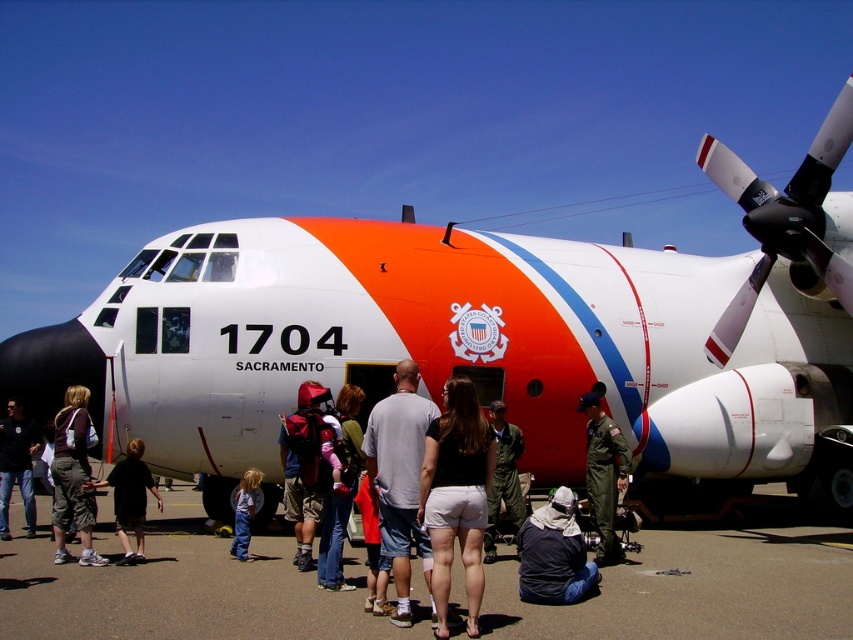
Can you confirm if gray cotton shirt at center is positioned to the left of light blue denim jeans at lower center?

Incorrect, gray cotton shirt at center is not on the left side of light blue denim jeans at lower center.

Does gray cotton shirt at center have a lesser width compared to light blue denim jeans at lower center?

No, gray cotton shirt at center is not thinner than light blue denim jeans at lower center.

Does point (413, 449) lie behind point (242, 493)?

No, (413, 449) is in front of (242, 493).

Where is `gray cotton shirt at center`? gray cotton shirt at center is located at coordinates (399, 480).

Is the position of smooth asphalt tarmac at center less distant than that of white cotton shorts at center?

No, it is not.

The image size is (853, 640). Find the location of `smooth asphalt tarmac at center`. smooth asphalt tarmac at center is located at coordinates (181, 589).

Locate an element on the screen. This screenshot has height=640, width=853. smooth asphalt tarmac at center is located at coordinates (181, 589).

Does black rubber propeller at right appear under black fabric shirt at lower left?

Incorrect, black rubber propeller at right is not positioned below black fabric shirt at lower left.

Can you confirm if black rubber propeller at right is shorter than black fabric shirt at lower left?

No, black rubber propeller at right is not shorter than black fabric shirt at lower left.

What do you see at coordinates (782, 221) in the screenshot? The height and width of the screenshot is (640, 853). I see `black rubber propeller at right` at bounding box center [782, 221].

Where is `black rubber propeller at right`? The width and height of the screenshot is (853, 640). black rubber propeller at right is located at coordinates (782, 221).